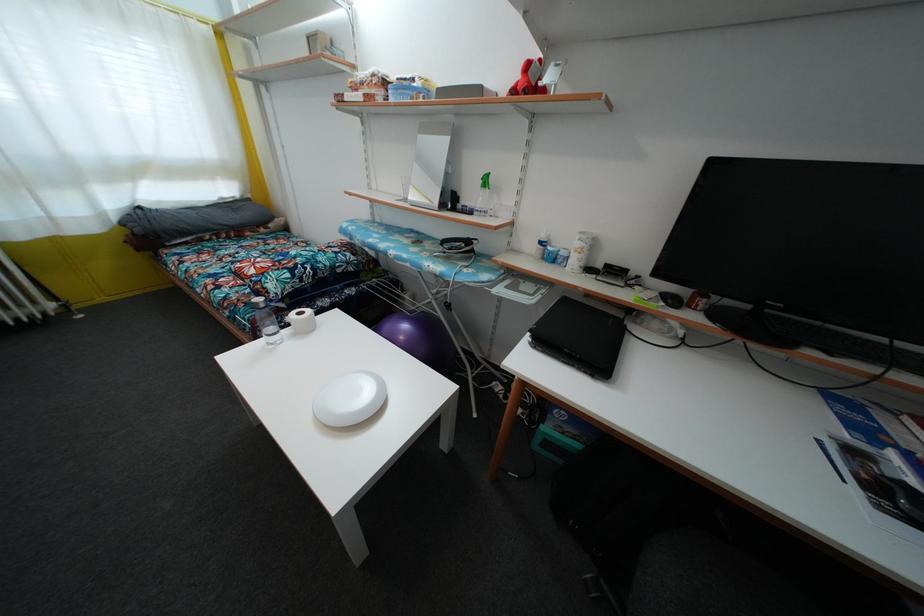
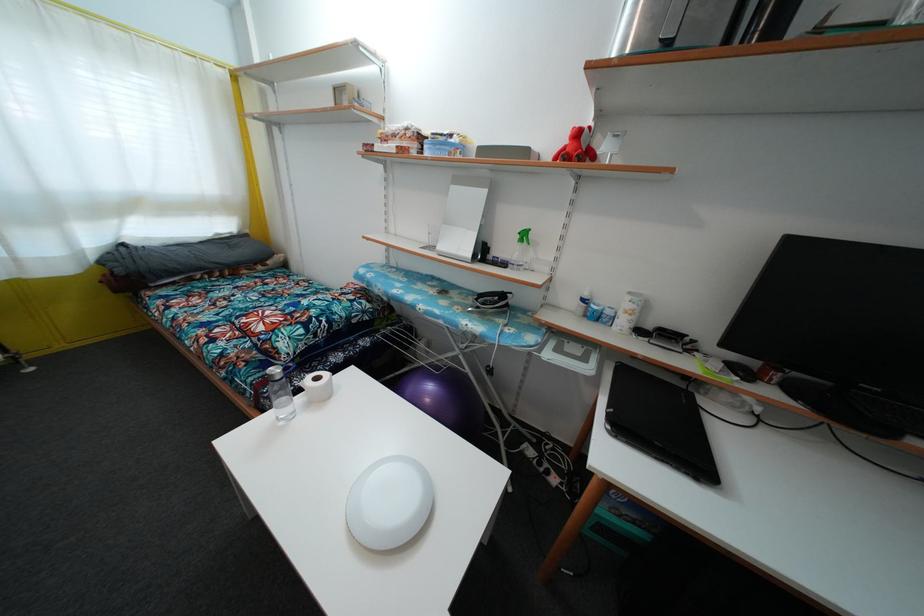
Find the pixel in the second image that matches point 664,300 in the first image.

(728, 369)